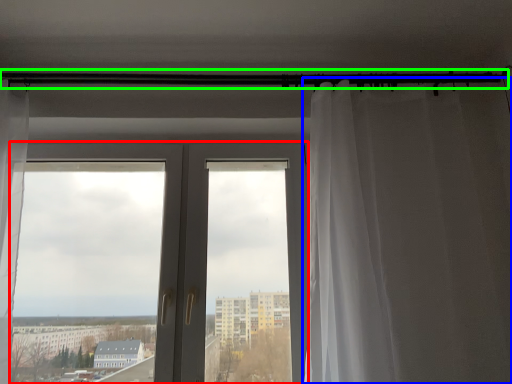
Question: Estimate the real-world distances between objects in this image. Which object is farther from door (highlighted by a red box), curtain (highlighted by a blue box) or beam (highlighted by a green box)?

Choices:
 (A) curtain
 (B) beam

Answer: (B)